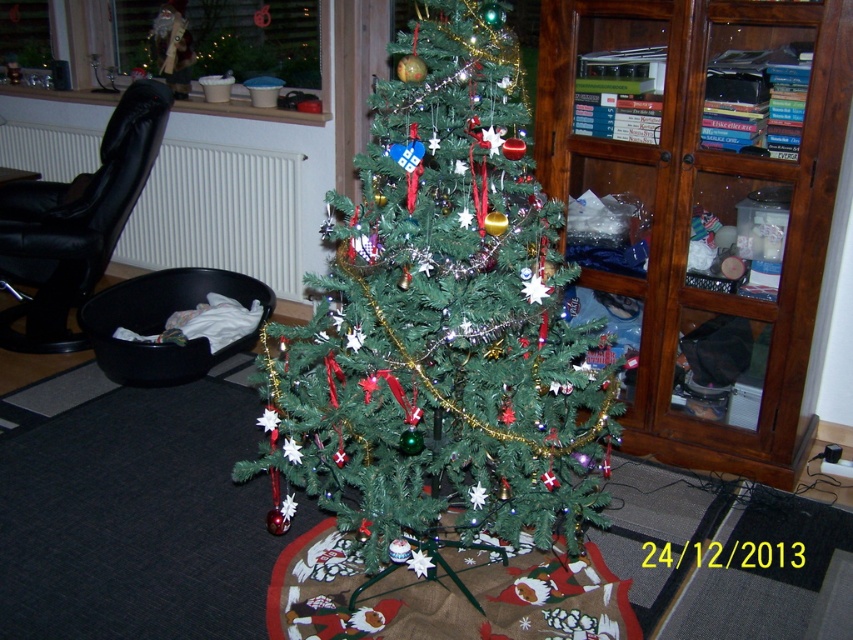
You are a delivery person holding a large box that is 1.5 meters tall. You need to place it near the green matte christmas tree at center without blocking the view of the tree from the window. Can you fit the box next to the tree while keeping the tree visible?

The distance between the green matte christmas tree at center and the viewer is 1.52 meters. Since the box is 1.5 meters tall, it is slightly shorter than the distance available. However, placing the box next to the tree might still block the view unless positioned carefully. To ensure visibility, place the box behind or to the side where it doesn not obstruct the line of sight from the window to the tree.

You are a delivery person who needs to place a new 36 inch wide package between the green matte christmas tree at center and the wooden cabinet at right. Can the package fit in the space between them?

The space between the green matte christmas tree at center and the wooden cabinet at right is 34.28 inches. Since the package is 36 inches wide, it is wider than the available space. The package cannot fit between them.